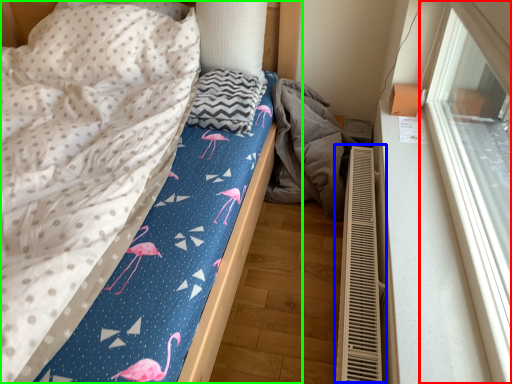
Question: Considering the real-world distances, which object is closest to window (highlighted by a red box)? air conditioner (highlighted by a blue box) or bed (highlighted by a green box).

Choices:
 (A) air conditioner
 (B) bed

Answer: (A)